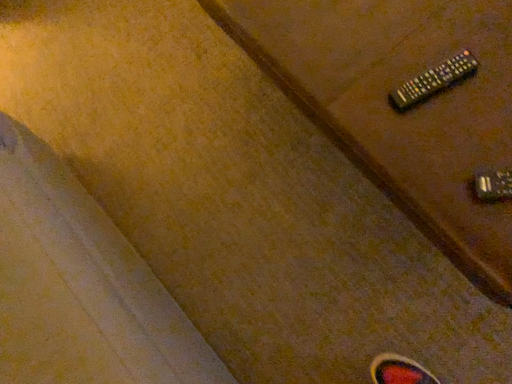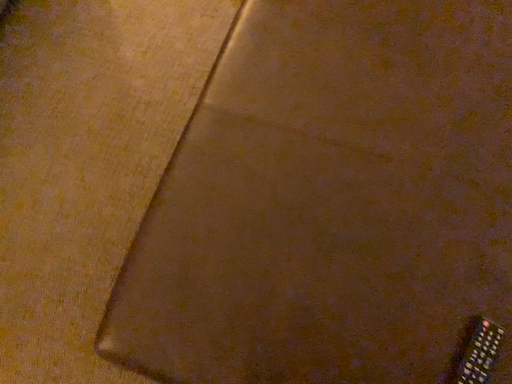
Question: Which way did the camera rotate in the video?

Choices:
 (A) rotated left
 (B) rotated right

Answer: (B)